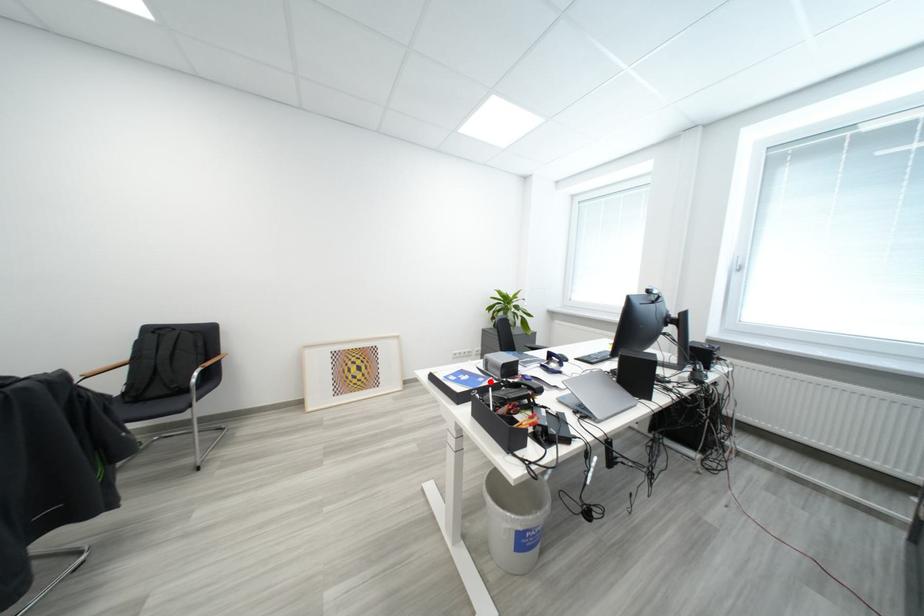
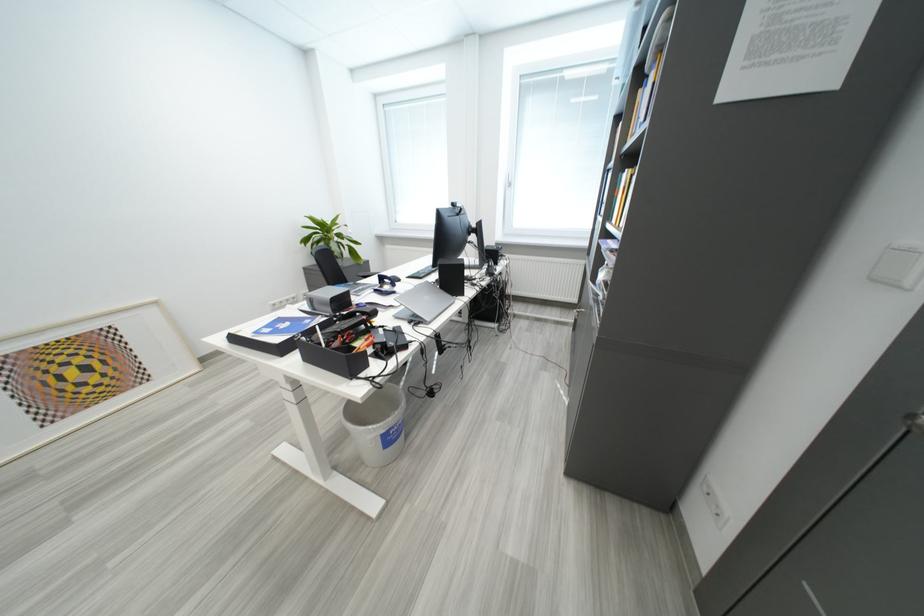
Question: I am providing you with two images of the same scene from different viewpoints. A red point is marked on the first image. Can you still see the location of the red point in image 2?

Choices:
 (A) Yes
 (B) No

Answer: (A)